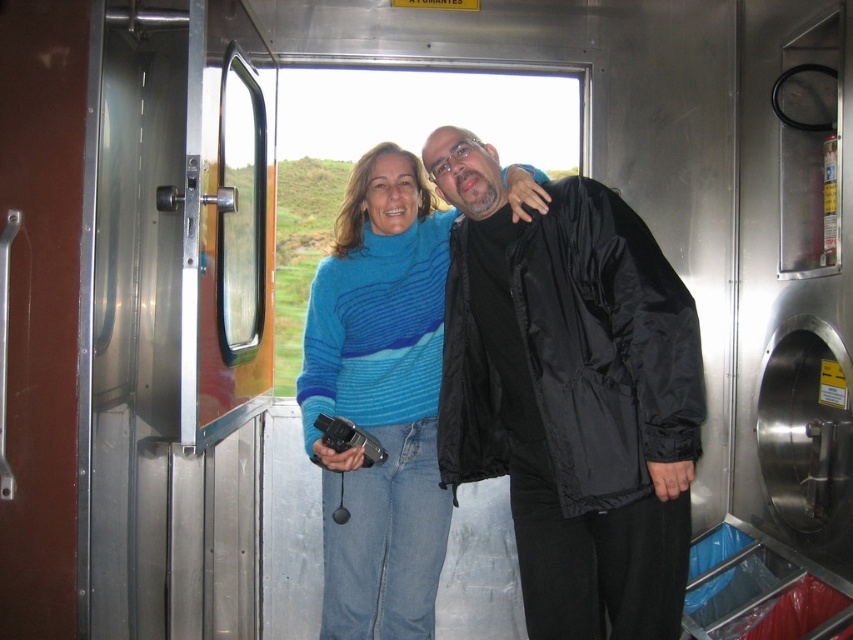
Question: Can you confirm if matte black jacket at center is positioned to the right of blue striped sweater at center?

Choices:
 (A) no
 (B) yes

Answer: (B)

Question: Which object appears closest to the camera in this image?

Choices:
 (A) blue striped sweater at center
 (B) matte black jacket at center

Answer: (B)

Question: Considering the relative positions of matte black jacket at center and blue striped sweater at center in the image provided, where is matte black jacket at center located with respect to blue striped sweater at center?

Choices:
 (A) right
 (B) left

Answer: (A)

Question: Which point is farther from the camera taking this photo?

Choices:
 (A) (546, 323)
 (B) (390, 369)

Answer: (B)

Question: Considering the relative positions of matte black jacket at center and blue striped sweater at center in the image provided, where is matte black jacket at center located with respect to blue striped sweater at center?

Choices:
 (A) left
 (B) right

Answer: (B)